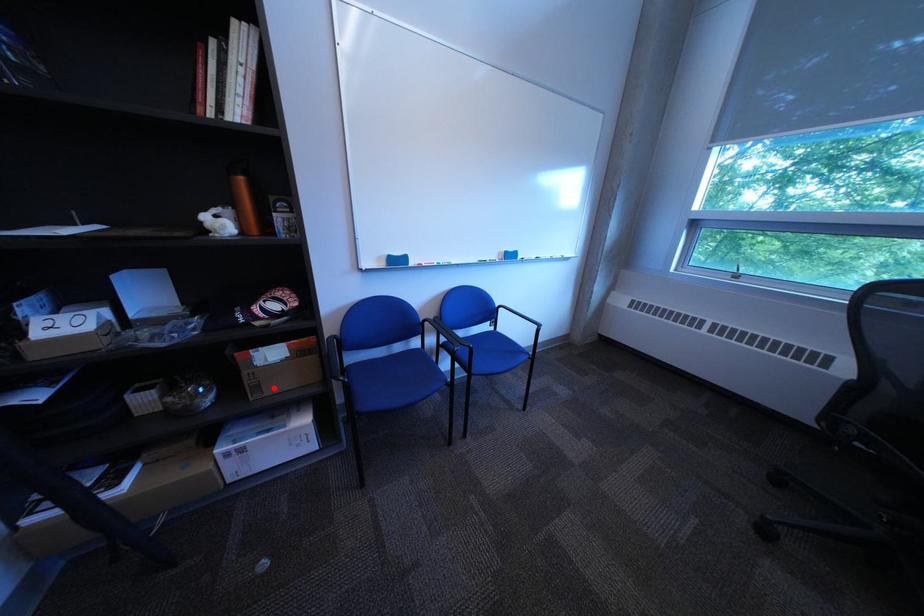
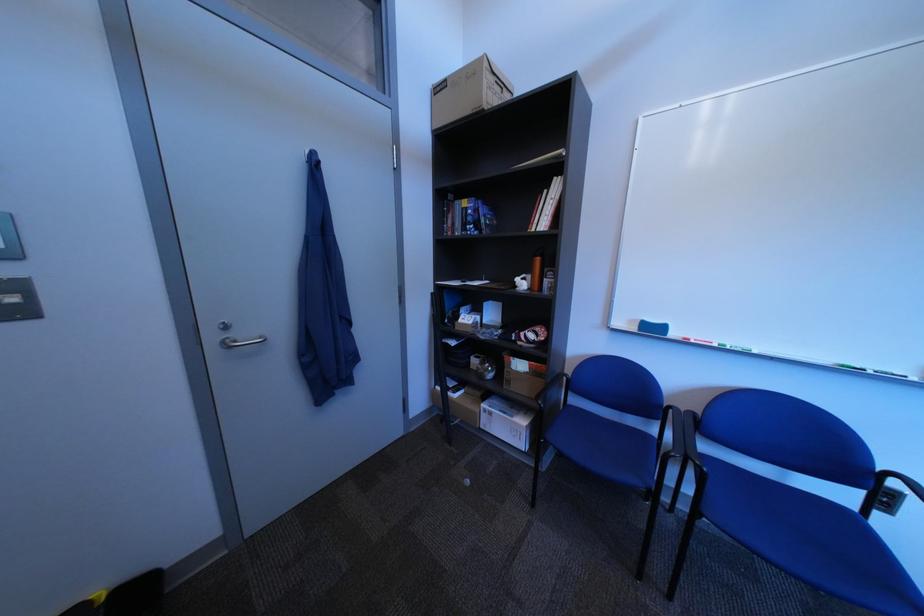
Question: A red point is marked in image1. In image2, is the corresponding 3D point closer to the camera or farther? Reply with the corresponding letter.

Choices:
 (A) The corresponding 3D point is closer.
 (B) The corresponding 3D point is farther.

Answer: (B)